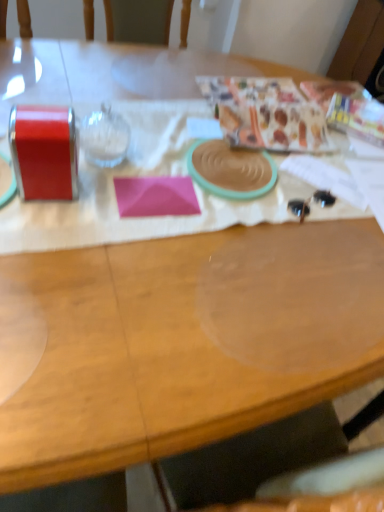
In order to face transparent glass at upper left, should I rotate leftwards or rightwards?

You should look left and rotate roughly 12.138 degrees.

This screenshot has width=384, height=512. Find the location of `patterned paper at upper right, marked as the first wrapping paper in a right-to-left arrangement`. patterned paper at upper right, marked as the first wrapping paper in a right-to-left arrangement is located at coordinates (349, 109).

How many degrees apart are the facing directions of transparent glass at upper left and patterned paper at upper right, which is counted as the 2th wrapping paper, starting from the left?

The angle between the facing direction of transparent glass at upper left and the facing direction of patterned paper at upper right, which is counted as the 2th wrapping paper, starting from the left, is 178 degrees.

Does transparent glass at upper left come in front of patterned paper at upper right, which is counted as the 2th wrapping paper, starting from the left?

Yes, the depth of transparent glass at upper left is less than that of patterned paper at upper right, which is counted as the 2th wrapping paper, starting from the left.

Is point (89, 143) farther from camera compared to point (317, 88)?

No, it is not.

Is transparent glass at upper left not inside patterned paper at upper right, marked as the first wrapping paper in a right-to-left arrangement?

transparent glass at upper left is positioned outside patterned paper at upper right, marked as the first wrapping paper in a right-to-left arrangement.

Is patterned paper at upper right, marked as the first wrapping paper in a right-to-left arrangement, directly adjacent to transparent glass at upper left?

No, patterned paper at upper right, marked as the first wrapping paper in a right-to-left arrangement, is not making contact with transparent glass at upper left.

Is point (383, 123) behind point (95, 131)?

Yes, it is behind point (95, 131).

Which object is more forward, patterned paper at upper right, which is counted as the 2th wrapping paper, starting from the left, or transparent glass at upper left?

Positioned in front is transparent glass at upper left.

Between patterned paper at upper right, which is counted as the 2th wrapping paper, starting from the left, and transparent glass at upper left, which one appears on the right side from the viewer's perspective?

Positioned to the right is patterned paper at upper right, which is counted as the 2th wrapping paper, starting from the left.

Is transparent glass at upper left facing away from matte plastic bag at upper right, arranged as the 1th wrapping paper when viewed from the left?

No, transparent glass at upper left's orientation is not away from matte plastic bag at upper right, arranged as the 1th wrapping paper when viewed from the left.

Choose the correct answer: Is transparent glass at upper left inside matte plastic bag at upper right, arranged as the 2th wrapping paper when viewed from the right, or outside it?

transparent glass at upper left is not enclosed by matte plastic bag at upper right, arranged as the 2th wrapping paper when viewed from the right.

From the image's perspective, is transparent glass at upper left on top of matte plastic bag at upper right, arranged as the 1th wrapping paper when viewed from the left?

No, from the image's perspective, transparent glass at upper left is not on top of matte plastic bag at upper right, arranged as the 1th wrapping paper when viewed from the left.

Does patterned paper at upper right, which is counted as the 2th wrapping paper, starting from the left, touch pink matte paper at center?

patterned paper at upper right, which is counted as the 2th wrapping paper, starting from the left, is not next to pink matte paper at center, and they're not touching.

Does patterned paper at upper right, marked as the first wrapping paper in a right-to-left arrangement, have a lesser height compared to pink matte paper at center?

Correct, patterned paper at upper right, marked as the first wrapping paper in a right-to-left arrangement, is not as tall as pink matte paper at center.

Considering the sizes of patterned paper at upper right, which is counted as the 2th wrapping paper, starting from the left, and pink matte paper at center in the image, is patterned paper at upper right, which is counted as the 2th wrapping paper, starting from the left, bigger or smaller than pink matte paper at center?

Considering their sizes, patterned paper at upper right, which is counted as the 2th wrapping paper, starting from the left, takes up more space than pink matte paper at center.

Is the depth of pink matte paper at center less than that of transparent glass at upper left?

Yes, pink matte paper at center is closer to the viewer.

In terms of height, does pink matte paper at center look taller or shorter compared to transparent glass at upper left?

Clearly, pink matte paper at center is shorter compared to transparent glass at upper left.

What are the coordinates of `wine glass behind the pink matte paper at center` in the screenshot? It's located at (104, 137).

Can you confirm if pink matte paper at center is smaller than transparent glass at upper left?

Indeed, pink matte paper at center has a smaller size compared to transparent glass at upper left.

Is matte plastic bag at upper right, arranged as the 1th wrapping paper when viewed from the left, positioned beyond the bounds of pink matte paper at center?

That's correct, matte plastic bag at upper right, arranged as the 1th wrapping paper when viewed from the left, is outside of pink matte paper at center.

Considering the sizes of objects matte plastic bag at upper right, arranged as the 2th wrapping paper when viewed from the right, and pink matte paper at center in the image provided, who is shorter, matte plastic bag at upper right, arranged as the 2th wrapping paper when viewed from the right, or pink matte paper at center?

With less height is matte plastic bag at upper right, arranged as the 2th wrapping paper when viewed from the right.

Considering their positions, is matte plastic bag at upper right, arranged as the 2th wrapping paper when viewed from the right, located in front of or behind pink matte paper at center?

matte plastic bag at upper right, arranged as the 2th wrapping paper when viewed from the right, is positioned farther from the viewer than pink matte paper at center.

Is matte plastic bag at upper right, arranged as the 2th wrapping paper when viewed from the right, facing towards transparent glass at upper left?

Yes, matte plastic bag at upper right, arranged as the 2th wrapping paper when viewed from the right, faces towards transparent glass at upper left.

Would you say transparent glass at upper left is part of matte plastic bag at upper right, arranged as the 2th wrapping paper when viewed from the right,'s contents?

No, transparent glass at upper left is located outside of matte plastic bag at upper right, arranged as the 2th wrapping paper when viewed from the right.

From a real-world perspective, between matte plastic bag at upper right, arranged as the 2th wrapping paper when viewed from the right, and transparent glass at upper left, who is vertically lower?

matte plastic bag at upper right, arranged as the 2th wrapping paper when viewed from the right, from a real-world perspective.

I want to click on wrapping paper that is the 2nd one below the transparent glass at upper left (from a real-world perspective), so click(x=349, y=109).

Locate an element on the screen. The height and width of the screenshot is (512, 384). wine glass lying on the left of patterned paper at upper right, which is counted as the 2th wrapping paper, starting from the left is located at coordinates (104, 137).

Which object lies nearer to the anchor point patterned paper at upper right, which is counted as the 2th wrapping paper, starting from the left, pink matte paper at center or transparent glass at upper left?

pink matte paper at center is positioned closer to the anchor patterned paper at upper right, which is counted as the 2th wrapping paper, starting from the left.

Estimate the real-world distances between objects in this image. Which object is further from patterned paper at upper right, marked as the first wrapping paper in a right-to-left arrangement, transparent glass at upper left or pink matte paper at center?

transparent glass at upper left.

From the image, which object appears to be farther from transparent glass at upper left, pink matte paper at center or patterned paper at upper right, which is counted as the 2th wrapping paper, starting from the left?

patterned paper at upper right, which is counted as the 2th wrapping paper, starting from the left.

Considering their positions, is matte plastic bag at upper right, arranged as the 1th wrapping paper when viewed from the left, positioned further to pink matte paper at center than patterned paper at upper right, which is counted as the 2th wrapping paper, starting from the left?

The object further to pink matte paper at center is patterned paper at upper right, which is counted as the 2th wrapping paper, starting from the left.

Estimate the real-world distances between objects in this image. Which object is further from transparent glass at upper left, patterned paper at upper right, which is counted as the 2th wrapping paper, starting from the left, or matte plastic bag at upper right, arranged as the 2th wrapping paper when viewed from the right?

Among the two, patterned paper at upper right, which is counted as the 2th wrapping paper, starting from the left, is located further to transparent glass at upper left.

Estimate the real-world distances between objects in this image. Which object is closer to matte plastic bag at upper right, arranged as the 1th wrapping paper when viewed from the left, patterned paper at upper right, which is counted as the 2th wrapping paper, starting from the left, or pink matte paper at center?

patterned paper at upper right, which is counted as the 2th wrapping paper, starting from the left, lies closer to matte plastic bag at upper right, arranged as the 1th wrapping paper when viewed from the left, than the other object.

From the image, which object appears to be nearer to transparent glass at upper left, matte plastic bag at upper right, arranged as the 2th wrapping paper when viewed from the right, or patterned paper at upper right, marked as the first wrapping paper in a right-to-left arrangement?

Among the two, matte plastic bag at upper right, arranged as the 2th wrapping paper when viewed from the right, is located nearer to transparent glass at upper left.

Which object lies further to the anchor point pink matte paper at center, transparent glass at upper left or matte plastic bag at upper right, arranged as the 1th wrapping paper when viewed from the left?

Based on the image, matte plastic bag at upper right, arranged as the 1th wrapping paper when viewed from the left, appears to be further to pink matte paper at center.

Where is `notepad between transparent glass at upper left and patterned paper at upper right, which is counted as the 2th wrapping paper, starting from the left`? The width and height of the screenshot is (384, 512). notepad between transparent glass at upper left and patterned paper at upper right, which is counted as the 2th wrapping paper, starting from the left is located at coordinates (155, 196).

Locate an element on the screen. notepad between transparent glass at upper left and matte plastic bag at upper right, arranged as the 2th wrapping paper when viewed from the right, in the horizontal direction is located at coordinates (155, 196).

Locate an element on the screen. Image resolution: width=384 pixels, height=512 pixels. wrapping paper between transparent glass at upper left and patterned paper at upper right, which is counted as the 2th wrapping paper, starting from the left, from left to right is located at coordinates (266, 114).

Where is `wrapping paper situated between pink matte paper at center and patterned paper at upper right, which is counted as the 2th wrapping paper, starting from the left, from left to right`? wrapping paper situated between pink matte paper at center and patterned paper at upper right, which is counted as the 2th wrapping paper, starting from the left, from left to right is located at coordinates (266, 114).